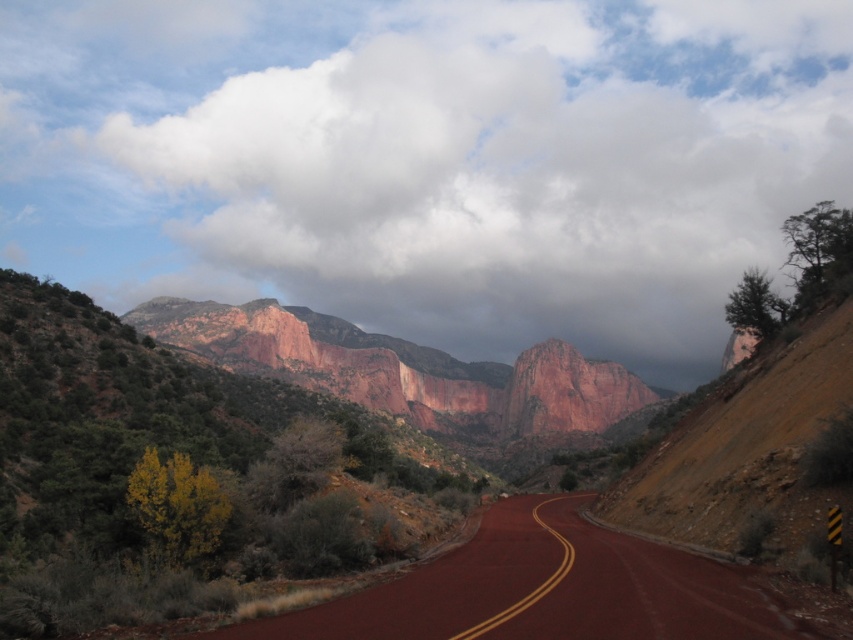
You are a GUI agent. You are given a task and a screenshot of the screen. Output one action in this format:
    pyautogui.click(x=<x>, y=<y>)
    Task: Click on the cloudy sky at upper center
    The image size is (853, 640).
    Given the screenshot: What is the action you would take?
    pyautogui.click(x=426, y=160)

Can you confirm if cloudy sky at upper center is positioned to the left of smooth asphalt road at center?

Indeed, cloudy sky at upper center is positioned on the left side of smooth asphalt road at center.

Who is more forward, (585, 35) or (590, 593)?

Point (590, 593) is more forward.

The height and width of the screenshot is (640, 853). Identify the location of cloudy sky at upper center. (426, 160).